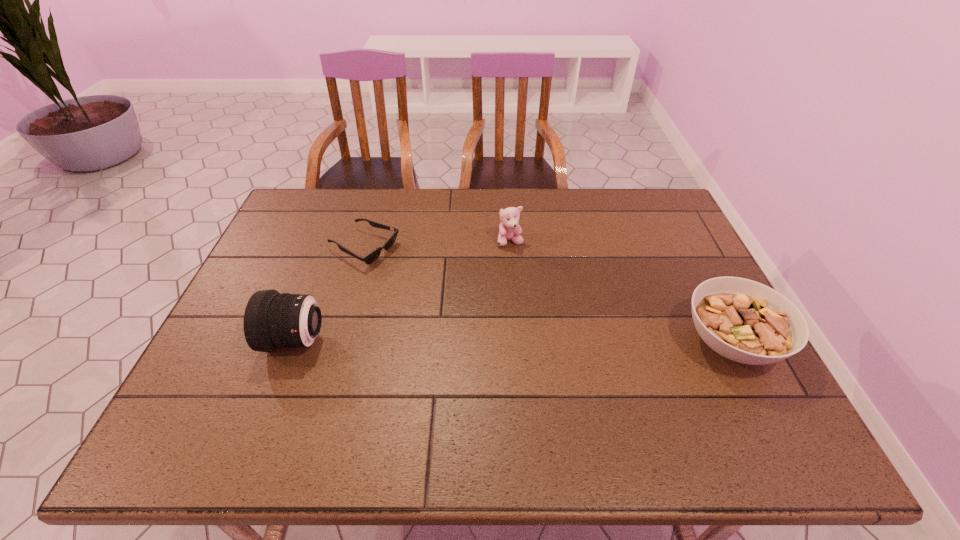
Locate an element on the screen. The width and height of the screenshot is (960, 540). empty space between the tallest object and the shortest object is located at coordinates (330, 294).

At what (x,y) coordinates should I click in order to perform the action: click on object that is the closest to the shortest object. Please return your answer as a coordinate pair (x, y). Looking at the image, I should click on (272, 320).

This screenshot has height=540, width=960. I want to click on object that is the third closest to the third object from left to right, so click(272, 320).